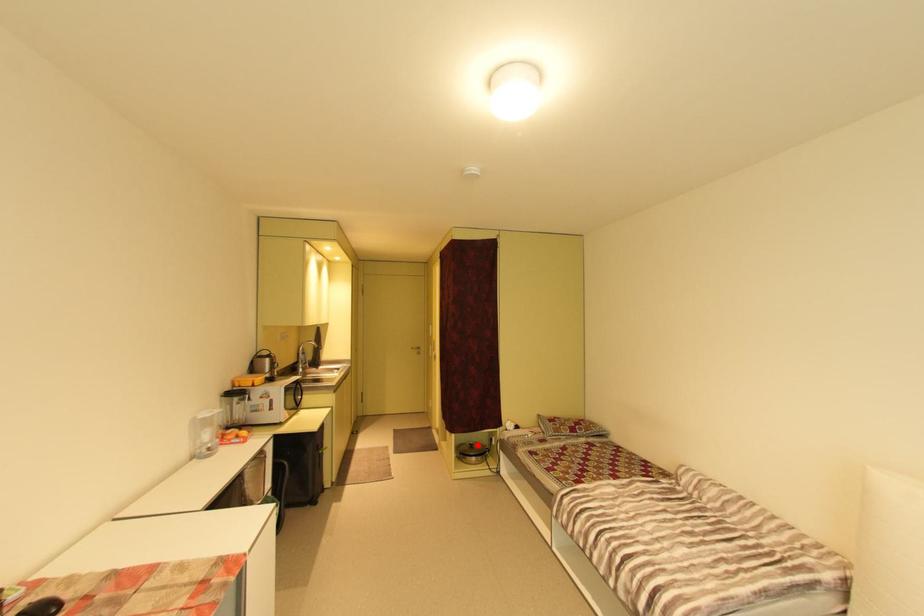
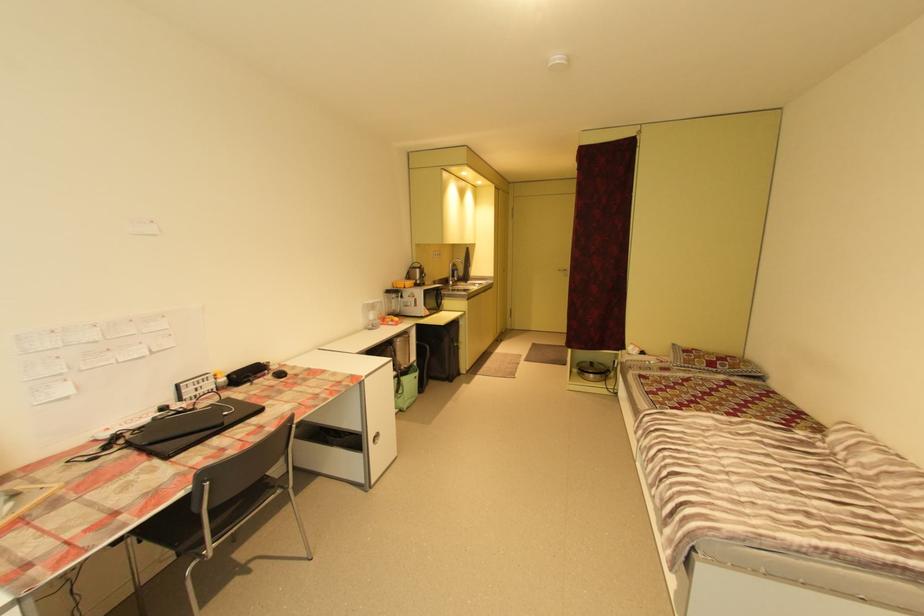
In the second image, find the point that corresponds to the highlighted location in the first image.

(598, 363)